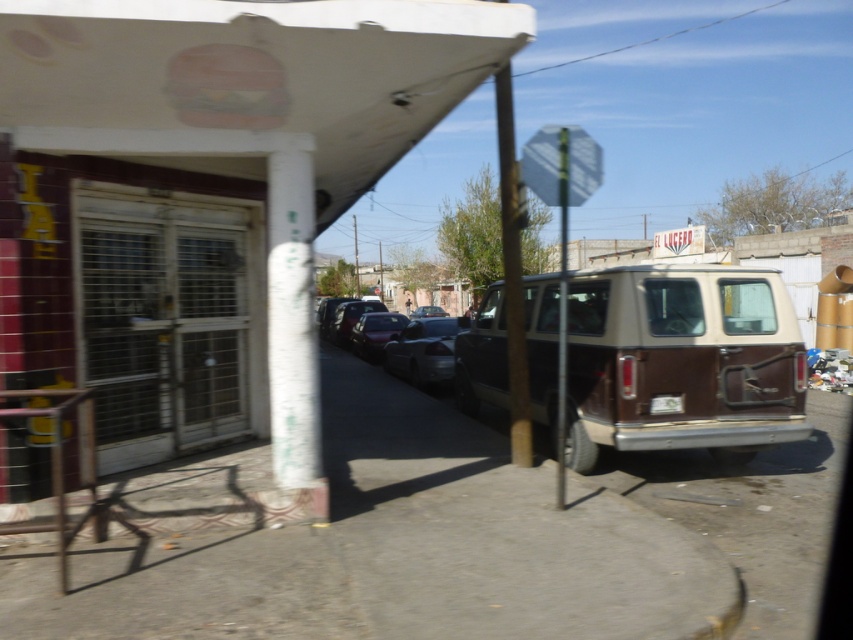
You are a delivery driver who needs to park your truck, which is 2.5 meters wide, in this area. There is a shiny black sedan at center and a glossy metallic car at center parked here. Can you determine if there is enough space between them to park your truck?

The shiny black sedan at center might be wider than glossy metallic car at center, so the space between them may not be sufficient for a truck that is 2.5 meters wide. It is recommended to look for another parking spot.

You are a delivery driver who needs to park your truck next to the brown matte van at center and the shiny silver sedan at center. Which vehicle should you park closer to if you want to maximize the available space for your truck?

You should park closer to the brown matte van at center because it occupies less space than the shiny silver sedan at center, leaving more room for your truck.

You are standing at the entrance of the gas station and want to park your car in the closest available spot to the brown matte van at center. Based on the image, can you determine the direction you should drive to reach the van?

The brown matte van at center is located at coordinates point (682, 360), so you should drive towards the center of the image to reach it.